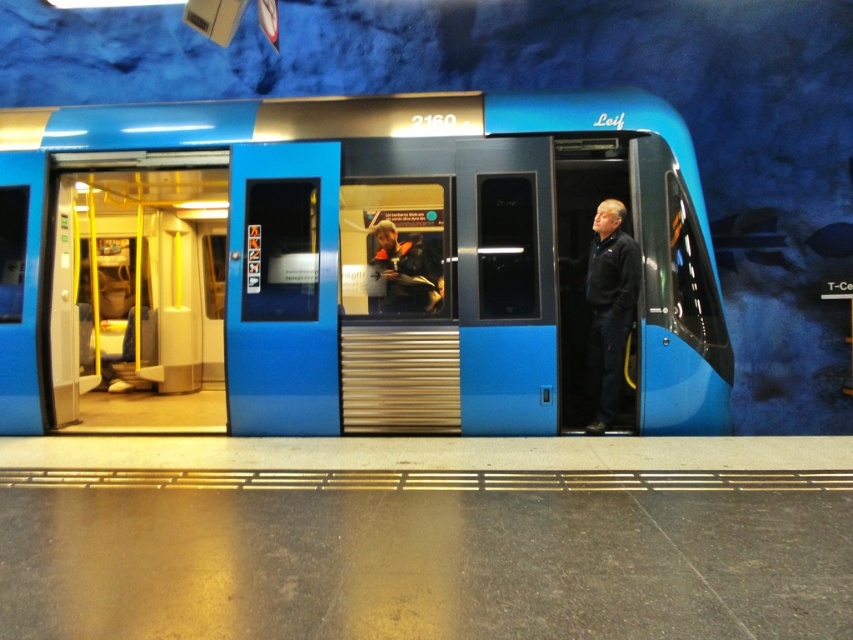
You are standing at the station platform and want to board the subway train. There are two points marked on the train doors. One is at point (45, 129) and the other at point (289, 264). Which point is closer to the back of the train when you board?

Point (45, 129) is behind point (289, 264), so it is closer to the back of the train when boarding.

You are a passenger on the subway train and want to know which of the two points, point (234, 394) or point (602, 372), is nearer to you. Can you determine this based on the scene?

Point (234, 394) is closer to the camera than point (602, 372), so the point (234, 394) is nearer to you.